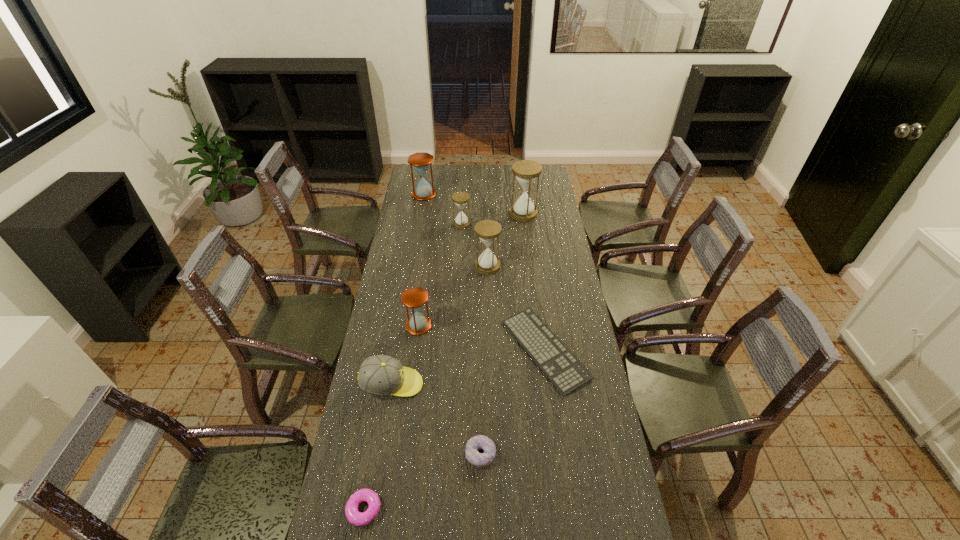
The height and width of the screenshot is (540, 960). Find the location of `free region that satisfies the following two spatial constraints: 1. on the back side of the shortest object; 2. on the right side of the farther doughnut`. free region that satisfies the following two spatial constraints: 1. on the back side of the shortest object; 2. on the right side of the farther doughnut is located at coordinates (481, 350).

Locate an element on the screen. vacant position in the image that satisfies the following two spatial constraints: 1. on the front side of the second nearest object; 2. on the right side of the bigger brown hourglass is located at coordinates (380, 454).